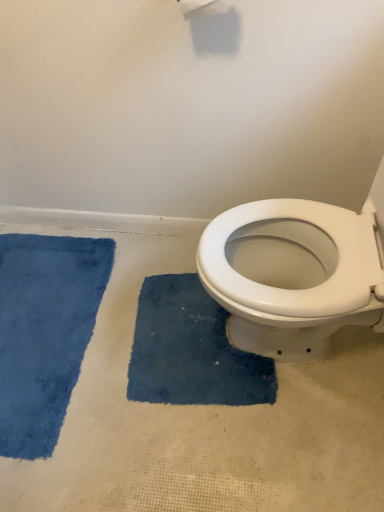
I want to click on vacant area that is situated to the right of blue plush bath mat at left, which ranks as the first bath mat in left-to-right order, so click(164, 413).